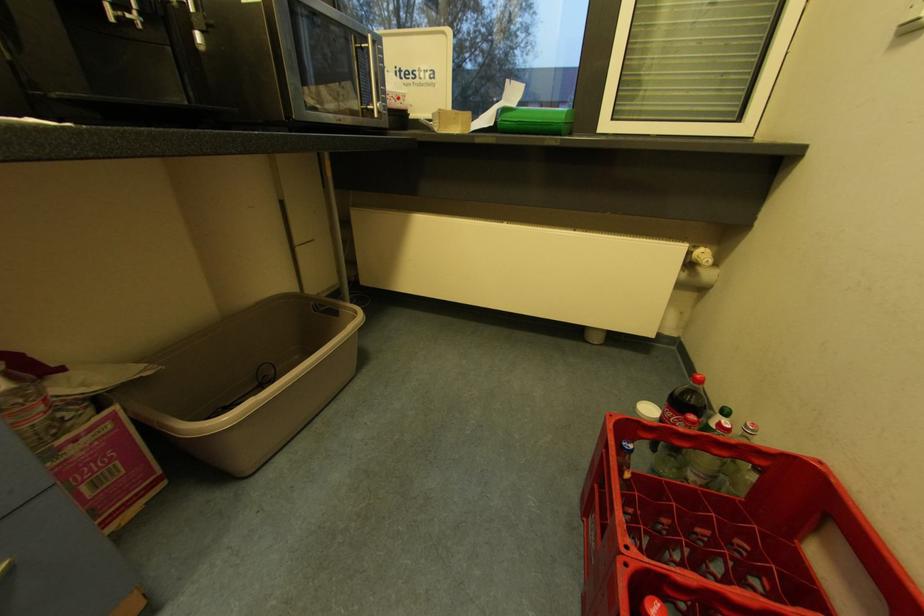
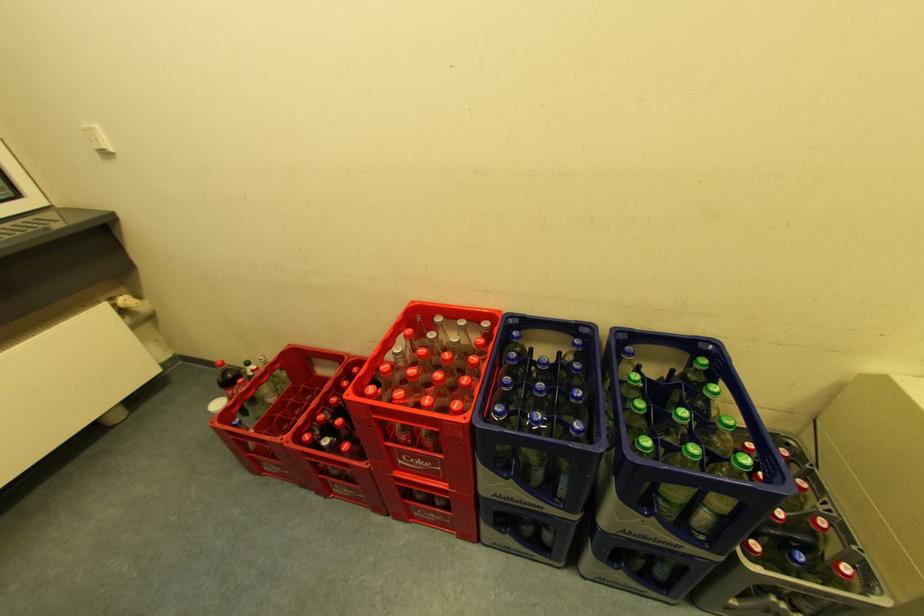
Based on the continuous images, in which direction is the camera rotating?

The rotation direction of the camera is right-down.